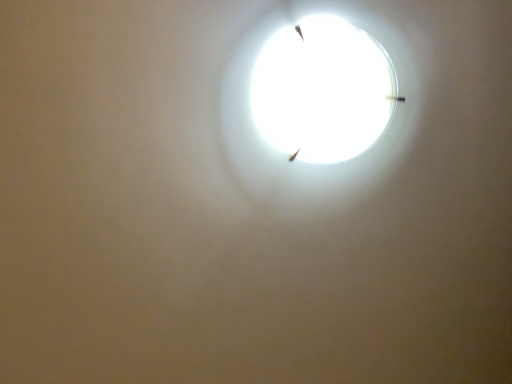
The image size is (512, 384). What do you see at coordinates (322, 90) in the screenshot? I see `white glossy lampshade at upper center` at bounding box center [322, 90].

Find the location of a particular element. The width and height of the screenshot is (512, 384). white glossy lampshade at upper center is located at coordinates (322, 90).

Consider the image. What is the approximate width of white glossy lampshade at upper center?

white glossy lampshade at upper center is 9.58 inches wide.

The width and height of the screenshot is (512, 384). Find the location of `white glossy lampshade at upper center`. white glossy lampshade at upper center is located at coordinates (322, 90).